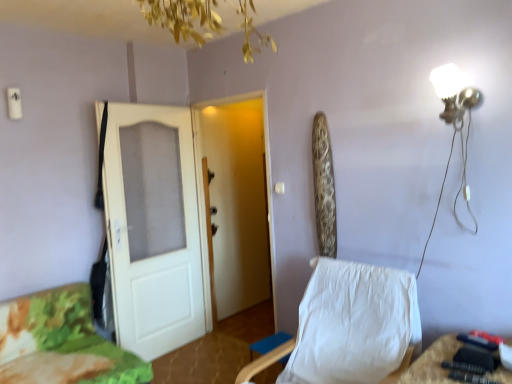
Identify the location of free location in front of white matte door at left, arranged as the 2th door when viewed from the right. Image resolution: width=512 pixels, height=384 pixels. (177, 366).